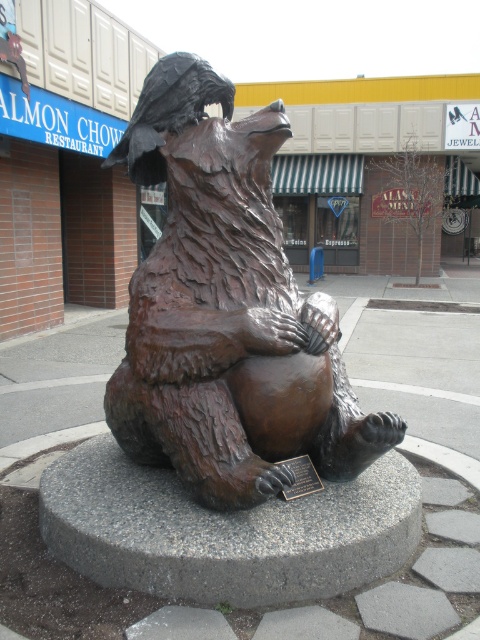
Question: Does bronze bear statue at center appear on the left side of bronze plaque at center?

Choices:
 (A) yes
 (B) no

Answer: (A)

Question: Does bronze bear statue at center have a larger size compared to bronze plaque at center?

Choices:
 (A) yes
 (B) no

Answer: (A)

Question: Among these points, which one is nearest to the camera?

Choices:
 (A) (392, 413)
 (B) (321, 484)

Answer: (A)

Question: Is bronze bear statue at center bigger than bronze plaque at center?

Choices:
 (A) yes
 (B) no

Answer: (A)